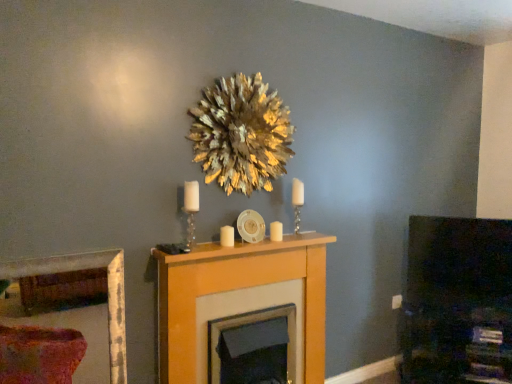
Question: From the image's perspective, is gold leafy wreath at upper center positioned above or below wooden picture frame at lower left?

Choices:
 (A) below
 (B) above

Answer: (B)

Question: Is gold leafy wreath at upper center wider or thinner than wooden picture frame at lower left?

Choices:
 (A) thin
 (B) wide

Answer: (B)

Question: Estimate the real-world distances between objects in this image. Which object is farther from the clear glass candle holder at center, marked as the 1th candle holder in a left-to-right arrangement?

Choices:
 (A) gold leafy wreath at upper center
 (B) wooden mantel at center
 (C) white glossy candle at center, which appears as the first candle when viewed from the right
 (D) clear glass candle holder at center, acting as the second candle holder starting from the left
 (E) white matte candle at center, the first candle in the left-to-right sequence

Answer: (D)

Question: Estimate the real-world distances between objects in this image. Which object is closer to the white glossy candle at center, the 1th candle in the back-to-front sequence?

Choices:
 (A) white matte candle at center, the first candle from the front
 (B) matte black tv at right
 (C) gold leafy wreath at upper center
 (D) clear glass candle holder at center, the 2th candle holder when ordered from right to left
 (E) wooden picture frame at lower left

Answer: (A)